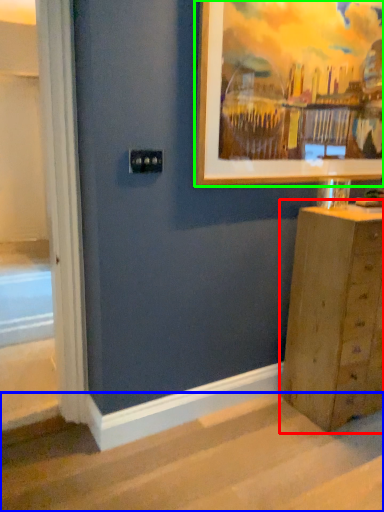
Question: Which object is positioned farthest from chest of drawers (highlighted by a red box)? Select from stairwell (highlighted by a blue box) and picture frame (highlighted by a green box).

Choices:
 (A) stairwell
 (B) picture frame

Answer: (B)